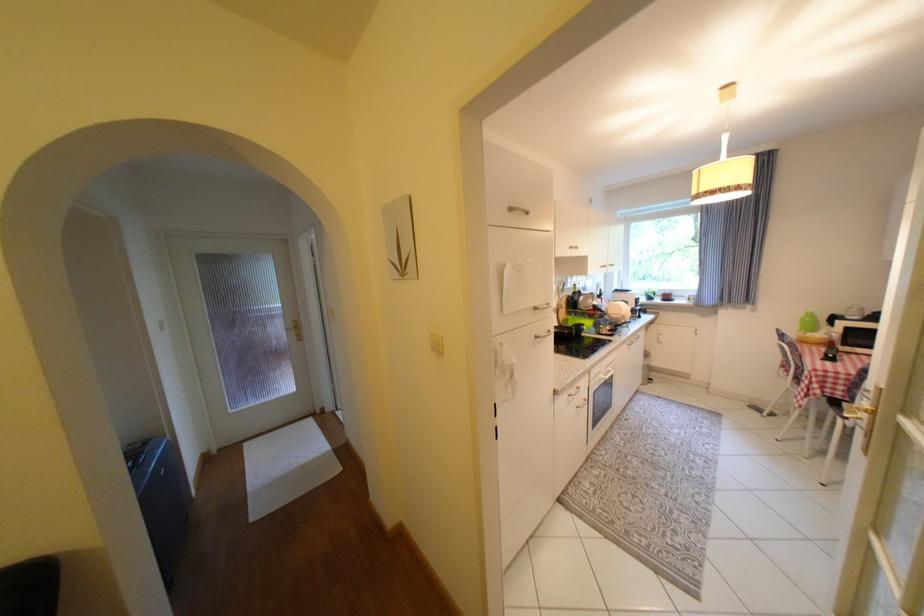
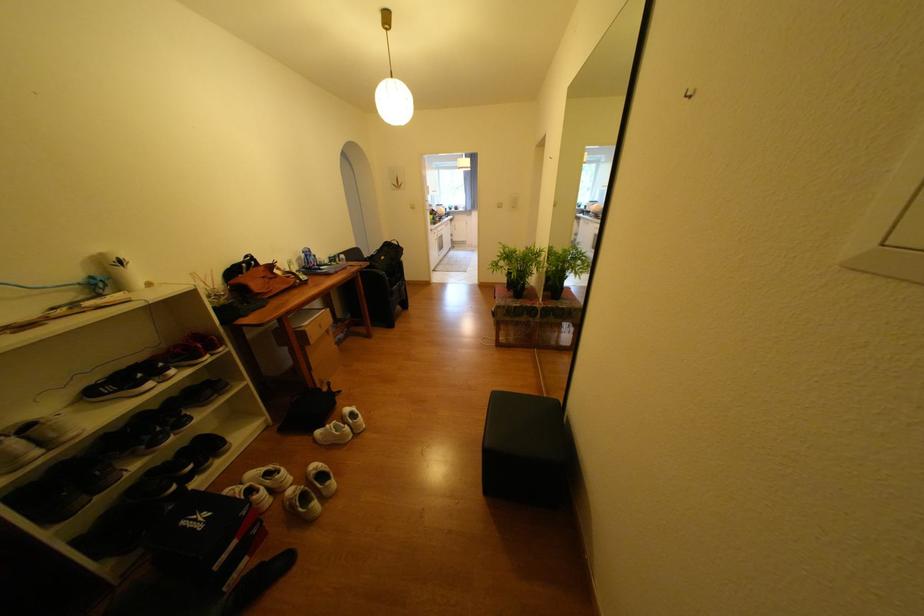
Question: I am providing you with two images of the same scene from different viewpoints. Which of the following objects are not visible in image2?

Choices:
 (A) silver cabinet handle
 (B) blue water bottle
 (C) rubik's cube toy
 (D) light switch button

Answer: (A)